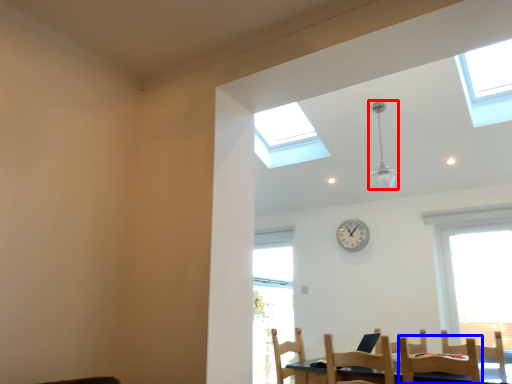
Question: Which of the following is the farthest to the observer, light fixture (highlighted by a red box) or chair (highlighted by a blue box)?

Choices:
 (A) light fixture
 (B) chair

Answer: (A)